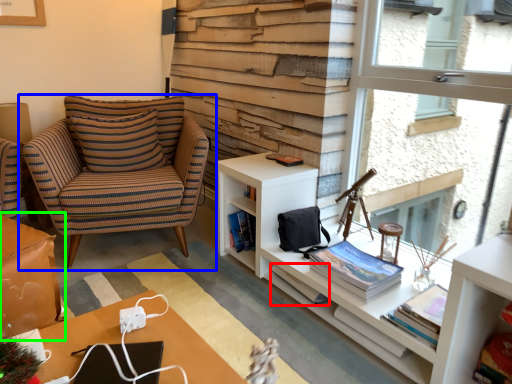
Question: Estimate the real-world distances between objects in this image. Which object is farther from book (highlighted by a red box), chair (highlighted by a blue box) or table (highlighted by a green box)?

Choices:
 (A) chair
 (B) table

Answer: (A)